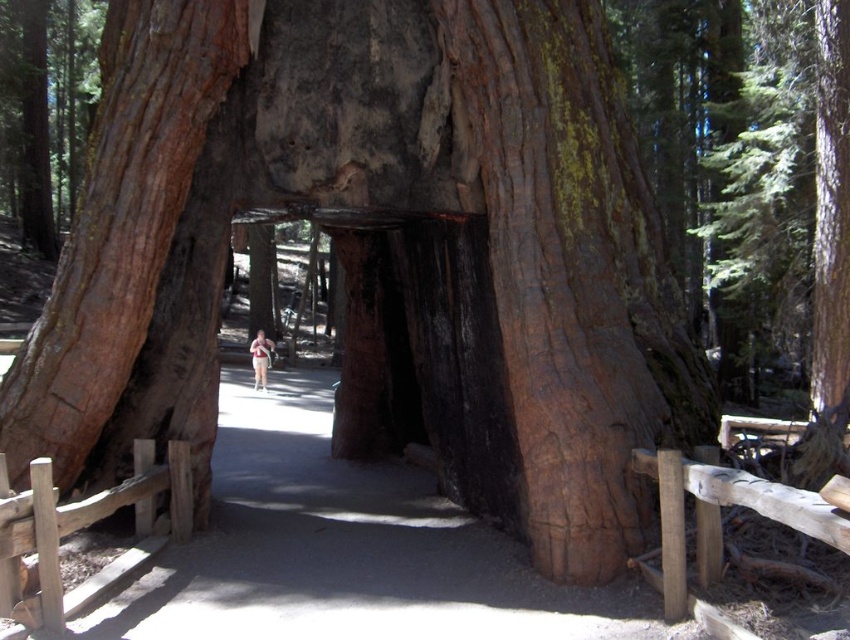
Question: Which point is closer to the camera?

Choices:
 (A) light brown skin at center
 (B) smooth brown bark at center

Answer: (B)

Question: Which object is positioned closest to the light brown skin at center?

Choices:
 (A) smooth brown bark at center
 (B) smooth brown bark at left

Answer: (B)

Question: Which point is farther to the camera?

Choices:
 (A) light brown skin at center
 (B) smooth brown bark at center

Answer: (A)

Question: From the image, what is the correct spatial relationship of smooth brown bark at center in relation to light brown skin at center?

Choices:
 (A) left
 (B) right

Answer: (B)

Question: Observing the image, what is the correct spatial positioning of smooth brown bark at center in reference to smooth brown bark at left?

Choices:
 (A) left
 (B) right

Answer: (B)

Question: In this image, where is smooth brown bark at left located relative to light brown skin at center?

Choices:
 (A) left
 (B) right

Answer: (B)